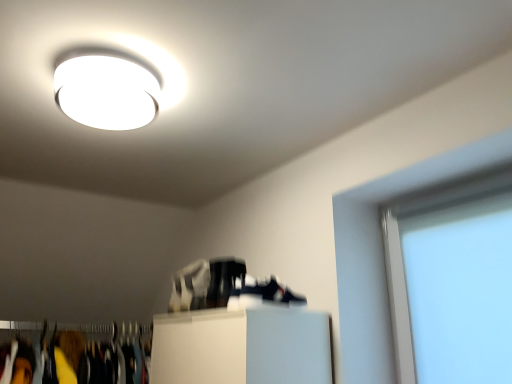
Identify the location of transparent glass window screen at right. (452, 281).

What do you see at coordinates (224, 280) in the screenshot? This screenshot has height=384, width=512. I see `shiny black shoe at center, placed as the first shoe when sorted from right to left` at bounding box center [224, 280].

Where is `white matte shoe at center, the 2th shoe positioned from the front`? The width and height of the screenshot is (512, 384). white matte shoe at center, the 2th shoe positioned from the front is located at coordinates (190, 287).

Looking at the image, does white glossy ceiling light at upper center seem bigger or smaller compared to shiny black shoe at center, arranged as the second shoe when viewed from the left?

white glossy ceiling light at upper center is bigger than shiny black shoe at center, arranged as the second shoe when viewed from the left.

Is white glossy ceiling light at upper center inside or outside of shiny black shoe at center, placed as the first shoe when sorted from right to left?

white glossy ceiling light at upper center cannot be found inside shiny black shoe at center, placed as the first shoe when sorted from right to left.

Based on the photo, is white glossy ceiling light at upper center not close to shiny black shoe at center, the 1th shoe in the front-to-back sequence?

No, white glossy ceiling light at upper center is not far away from shiny black shoe at center, the 1th shoe in the front-to-back sequence.

Locate an element on the screen. lamp lying in front of the shiny black shoe at center, the 1th shoe in the front-to-back sequence is located at coordinates click(111, 87).

Considering the positions of point (219, 286) and point (428, 279), is point (219, 286) closer or farther from the camera than point (428, 279)?

Point (219, 286) appears to be farther away from the viewer than point (428, 279).

How far apart are shiny black shoe at center, the 1th shoe in the front-to-back sequence, and transparent glass window screen at right?

shiny black shoe at center, the 1th shoe in the front-to-back sequence, and transparent glass window screen at right are 27.88 inches apart from each other.

Can you tell me how much shiny black shoe at center, placed as the first shoe when sorted from right to left, and transparent glass window screen at right differ in facing direction?

The angular difference between shiny black shoe at center, placed as the first shoe when sorted from right to left, and transparent glass window screen at right is 0.351 degrees.

Is the depth of shiny black shoe at center, placed as the first shoe when sorted from right to left, less than that of transparent glass window screen at right?

That is False.

From the picture: From the image's perspective, is white matte shoe at center, the 2th shoe positioned from the front, located above or below transparent glass window screen at right?

Clearly, from the image's perspective, white matte shoe at center, the 2th shoe positioned from the front, is below transparent glass window screen at right.

Can you tell me how much white matte shoe at center, the second shoe in the right-to-left sequence, and transparent glass window screen at right differ in facing direction?

white matte shoe at center, the second shoe in the right-to-left sequence, and transparent glass window screen at right are facing 0.35 degrees away from each other.

Does point (193, 276) come behind point (435, 323)?

Yes, point (193, 276) is farther from viewer.

In terms of height, does white matte shoe at center, the second shoe in the right-to-left sequence, look taller or shorter compared to transparent glass window screen at right?

Clearly, white matte shoe at center, the second shoe in the right-to-left sequence, is shorter compared to transparent glass window screen at right.

What's the angular difference between shiny black shoe at center, arranged as the second shoe when viewed from the left, and white matte shoe at center, acting as the first shoe starting from the left,'s facing directions?

shiny black shoe at center, arranged as the second shoe when viewed from the left, and white matte shoe at center, acting as the first shoe starting from the left, are facing 0.00215 degrees away from each other.

In terms of height, does shiny black shoe at center, which is the second shoe from back to front, look taller or shorter compared to white matte shoe at center, the second shoe in the right-to-left sequence?

Clearly, shiny black shoe at center, which is the second shoe from back to front, is shorter compared to white matte shoe at center, the second shoe in the right-to-left sequence.

Which object is further away from the camera taking this photo, shiny black shoe at center, the 1th shoe in the front-to-back sequence, or white matte shoe at center, the 2th shoe positioned from the front?

white matte shoe at center, the 2th shoe positioned from the front, is further away from the camera.

In terms of size, does shiny black shoe at center, the 1th shoe in the front-to-back sequence, appear bigger or smaller than white matte shoe at center, acting as the first shoe starting from the left?

shiny black shoe at center, the 1th shoe in the front-to-back sequence, is smaller than white matte shoe at center, acting as the first shoe starting from the left.

Which of these two, transparent glass window screen at right or white glossy ceiling light at upper center, is smaller?

With smaller size is white glossy ceiling light at upper center.

Would you say transparent glass window screen at right is a long distance from white glossy ceiling light at upper center?

transparent glass window screen at right is far away from white glossy ceiling light at upper center.

Considering the sizes of transparent glass window screen at right and white glossy ceiling light at upper center in the image, is transparent glass window screen at right wider or thinner than white glossy ceiling light at upper center?

Clearly, transparent glass window screen at right has less width compared to white glossy ceiling light at upper center.

Could you tell me if transparent glass window screen at right is turned towards white glossy ceiling light at upper center?

Yes, transparent glass window screen at right is aimed at white glossy ceiling light at upper center.

Between white matte shoe at center, acting as the first shoe starting from the left, and white glossy ceiling light at upper center, which one has smaller size?

Smaller between the two is white matte shoe at center, acting as the first shoe starting from the left.

Measure the distance from white matte shoe at center, the 1th shoe when ordered from back to front, to white glossy ceiling light at upper center.

white matte shoe at center, the 1th shoe when ordered from back to front, is 28.50 inches from white glossy ceiling light at upper center.

From the picture: Between white matte shoe at center, the 1th shoe when ordered from back to front, and white glossy ceiling light at upper center, which one has smaller width?

white matte shoe at center, the 1th shoe when ordered from back to front.

From the image's perspective, which is below, white matte shoe at center, the 2th shoe positioned from the front, or white glossy ceiling light at upper center?

white matte shoe at center, the 2th shoe positioned from the front, appears lower in the image.

From the image's perspective, which one is positioned higher, white matte shoe at center, the 1th shoe when ordered from back to front, or shiny black shoe at center, arranged as the second shoe when viewed from the left?

shiny black shoe at center, arranged as the second shoe when viewed from the left.

From a real-world perspective, is white matte shoe at center, the 1th shoe when ordered from back to front, physically above shiny black shoe at center, the 1th shoe in the front-to-back sequence?

Correct, in the physical world, white matte shoe at center, the 1th shoe when ordered from back to front, is higher than shiny black shoe at center, the 1th shoe in the front-to-back sequence.

Is white matte shoe at center, acting as the first shoe starting from the left, to the right of shiny black shoe at center, arranged as the second shoe when viewed from the left, from the viewer's perspective?

No.

Which shoe is the 1st one when counting from the back of the white glossy ceiling light at upper center? Please provide its 2D coordinates.

[(224, 280)]

Where is `the 1st shoe positioned above the transparent glass window screen at right (from a real-world perspective)`? the 1st shoe positioned above the transparent glass window screen at right (from a real-world perspective) is located at coordinates (224, 280).

Looking at the image, which one is located closer to transparent glass window screen at right, white matte shoe at center, the 1th shoe when ordered from back to front, or white glossy ceiling light at upper center?

The object closer to transparent glass window screen at right is white matte shoe at center, the 1th shoe when ordered from back to front.

When comparing their distances from transparent glass window screen at right, does shiny black shoe at center, the 1th shoe in the front-to-back sequence, or white matte shoe at center, the 2th shoe positioned from the front, seem further?

white matte shoe at center, the 2th shoe positioned from the front.

Estimate the real-world distances between objects in this image. Which object is closer to white matte shoe at center, the 1th shoe when ordered from back to front, shiny black shoe at center, placed as the first shoe when sorted from right to left, or transparent glass window screen at right?

shiny black shoe at center, placed as the first shoe when sorted from right to left, is closer to white matte shoe at center, the 1th shoe when ordered from back to front.

Which object lies nearer to the anchor point white matte shoe at center, acting as the first shoe starting from the left, transparent glass window screen at right or white glossy ceiling light at upper center?

The object closer to white matte shoe at center, acting as the first shoe starting from the left, is white glossy ceiling light at upper center.

Which object lies further to the anchor point white glossy ceiling light at upper center, transparent glass window screen at right or shiny black shoe at center, arranged as the second shoe when viewed from the left?

Among the two, transparent glass window screen at right is located further to white glossy ceiling light at upper center.

Which object lies further to the anchor point transparent glass window screen at right, white glossy ceiling light at upper center or shiny black shoe at center, the 1th shoe in the front-to-back sequence?

white glossy ceiling light at upper center lies further to transparent glass window screen at right than the other object.

Which object lies nearer to the anchor point shiny black shoe at center, the 1th shoe in the front-to-back sequence, white matte shoe at center, the 1th shoe when ordered from back to front, or white glossy ceiling light at upper center?

Among the two, white matte shoe at center, the 1th shoe when ordered from back to front, is located nearer to shiny black shoe at center, the 1th shoe in the front-to-back sequence.

Estimate the real-world distances between objects in this image. Which object is closer to shiny black shoe at center, which is the second shoe from back to front, white matte shoe at center, the second shoe in the right-to-left sequence, or transparent glass window screen at right?

white matte shoe at center, the second shoe in the right-to-left sequence.

Where is `shoe between white glossy ceiling light at upper center and white matte shoe at center, the 2th shoe positioned from the front, from top to bottom`? This screenshot has width=512, height=384. shoe between white glossy ceiling light at upper center and white matte shoe at center, the 2th shoe positioned from the front, from top to bottom is located at coordinates (224, 280).

The width and height of the screenshot is (512, 384). What are the coordinates of `shoe between white matte shoe at center, acting as the first shoe starting from the left, and transparent glass window screen at right` in the screenshot? It's located at (224, 280).